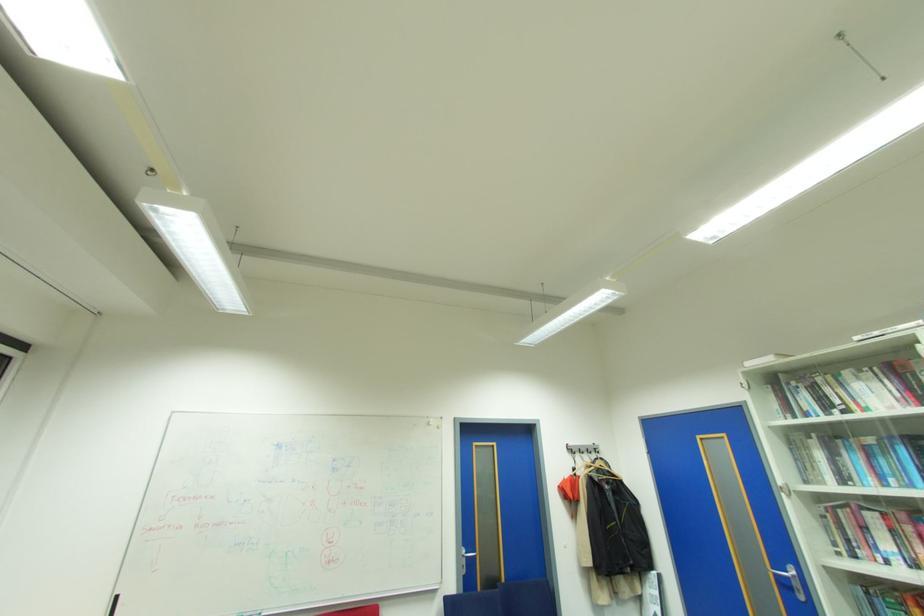
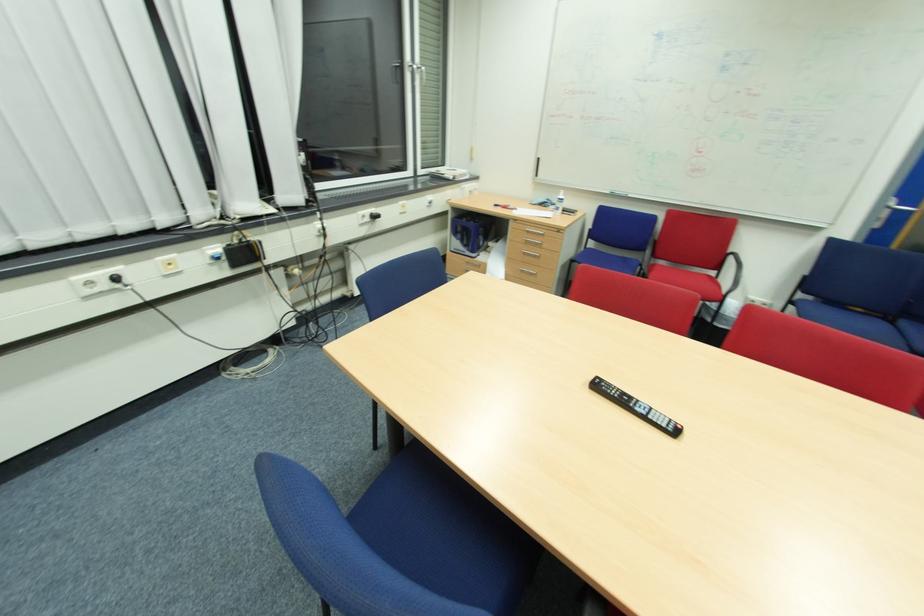
The first image is from the beginning of the video and the second image is from the end. How did the camera likely rotate when shooting the video?

The rotation direction of the camera is left-down.